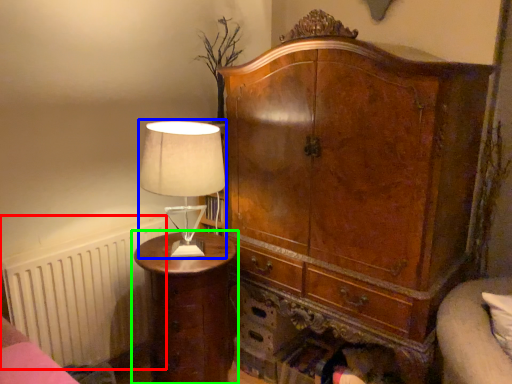
Question: Estimate the real-world distances between objects in this image. Which object is farther from radiator (highlighted by a red box), table lamp (highlighted by a blue box) or nightstand (highlighted by a green box)?

Choices:
 (A) table lamp
 (B) nightstand

Answer: (A)